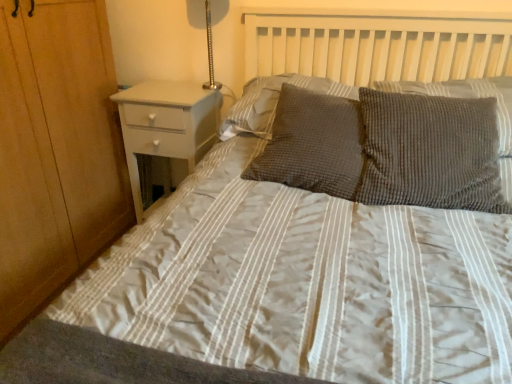
Question: From the image's perspective, is textured gray pillow at center, arranged as the 4th pillow when viewed from the right, above or below textured gray pillow at center, marked as the 4th pillow in a left-to-right arrangement?

Choices:
 (A) below
 (B) above

Answer: (B)

Question: Considering their positions, is textured gray pillow at center, the 1th pillow when ordered from left to right, located in front of or behind textured gray pillow at center, acting as the 1th pillow starting from the right?

Choices:
 (A) front
 (B) behind

Answer: (B)

Question: Based on their relative distances, which object is farther from the metallic silver lamp at upper right?

Choices:
 (A) textured gray pillow at center, arranged as the 4th pillow when viewed from the right
 (B) textured gray pillow at center, which is counted as the second pillow, starting from the right
 (C) white glossy nightstand at left
 (D) textured gray pillow at center, acting as the 1th pillow starting from the right
 (E) textured gray pillow at center, marked as the 2th pillow in a left-to-right arrangement

Answer: (B)

Question: Based on their relative distances, which object is nearer to the textured gray pillow at center, acting as the 1th pillow starting from the right?

Choices:
 (A) white glossy nightstand at left
 (B) textured gray pillow at center, marked as the 2th pillow in a left-to-right arrangement
 (C) textured gray pillow at center, the 1th pillow when ordered from left to right
 (D) textured gray pillow at center, acting as the 3th pillow starting from the left
 (E) metallic silver lamp at upper right

Answer: (D)